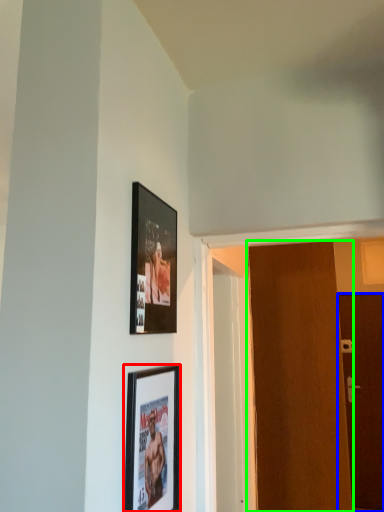
Question: Based on their relative distances, which object is farther from picture frame (highlighted by a red box)? Choose from door (highlighted by a blue box) and door (highlighted by a green box).

Choices:
 (A) door
 (B) door

Answer: (A)